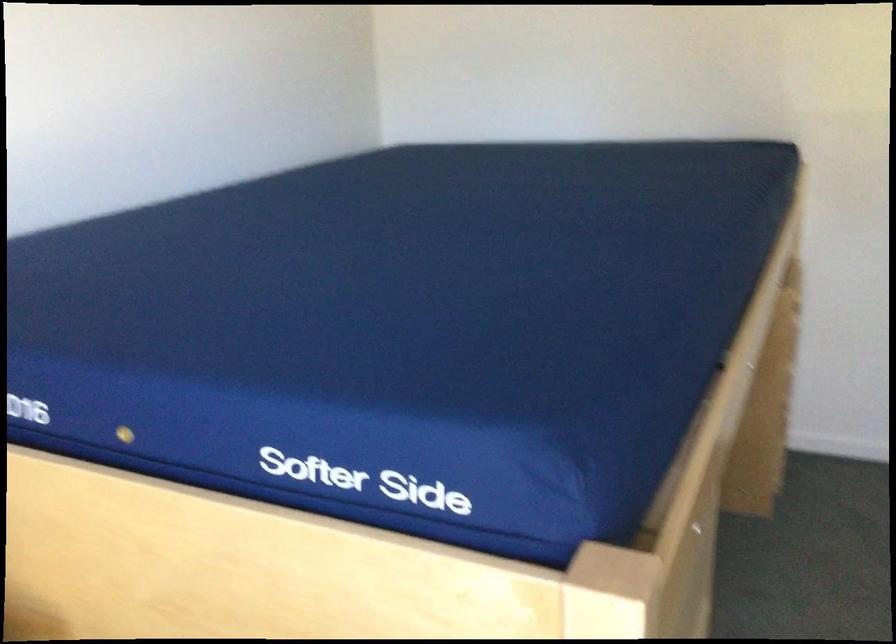
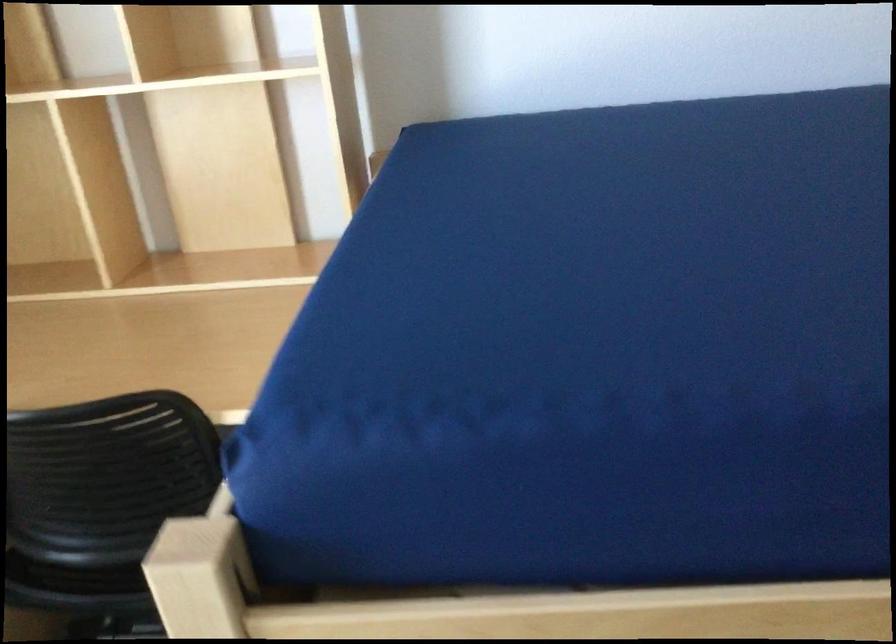
First-person continuous shooting, in which direction is the camera rotating?

The camera rotated toward left-down.